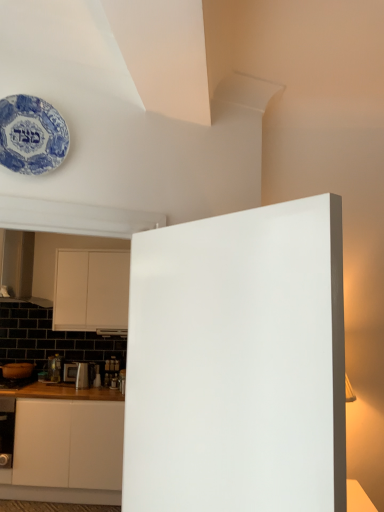
Question: Considering the relative sizes of metallic silver toaster at lower left and blue porcelain plate at upper left in the image provided, is metallic silver toaster at lower left wider than blue porcelain plate at upper left?

Choices:
 (A) yes
 (B) no

Answer: (A)

Question: From a real-world perspective, does metallic silver toaster at lower left sit lower than blue porcelain plate at upper left?

Choices:
 (A) yes
 (B) no

Answer: (A)

Question: Is metallic silver toaster at lower left smaller than blue porcelain plate at upper left?

Choices:
 (A) yes
 (B) no

Answer: (B)

Question: Are metallic silver toaster at lower left and blue porcelain plate at upper left located far from each other?

Choices:
 (A) yes
 (B) no

Answer: (A)

Question: Considering the relative positions of metallic silver toaster at lower left and blue porcelain plate at upper left in the image provided, is metallic silver toaster at lower left to the right of blue porcelain plate at upper left from the viewer's perspective?

Choices:
 (A) no
 (B) yes

Answer: (A)

Question: Is metallic silver toaster at lower left beside blue porcelain plate at upper left?

Choices:
 (A) no
 (B) yes

Answer: (A)

Question: From the image's perspective, is white matte door at center located beneath blue porcelain plate at upper left?

Choices:
 (A) no
 (B) yes

Answer: (B)

Question: Is white matte door at center oriented towards blue porcelain plate at upper left?

Choices:
 (A) yes
 (B) no

Answer: (B)

Question: From the image's perspective, is white matte door at center over blue porcelain plate at upper left?

Choices:
 (A) no
 (B) yes

Answer: (A)

Question: Does white matte door at center have a larger size compared to blue porcelain plate at upper left?

Choices:
 (A) yes
 (B) no

Answer: (A)

Question: Considering the relative sizes of white matte door at center and blue porcelain plate at upper left in the image provided, is white matte door at center smaller than blue porcelain plate at upper left?

Choices:
 (A) no
 (B) yes

Answer: (A)

Question: Is white matte door at center not within blue porcelain plate at upper left?

Choices:
 (A) yes
 (B) no

Answer: (A)

Question: Is blue porcelain plate at upper left closer to camera compared to metallic silver toaster at lower left?

Choices:
 (A) yes
 (B) no

Answer: (A)